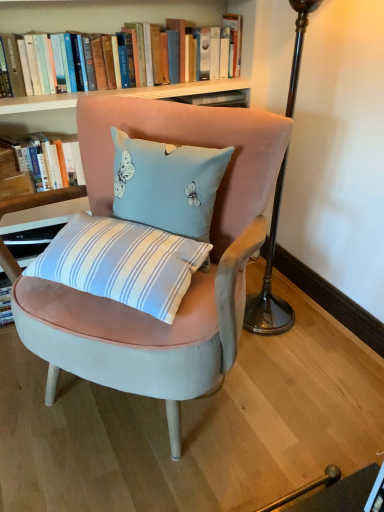
Question: Is velvet pink chair at center thinner than hardcover book at upper left, positioned as the first book in bottom-to-top order?

Choices:
 (A) no
 (B) yes

Answer: (A)

Question: Can you confirm if velvet pink chair at center is wider than hardcover book at upper left, positioned as the first book in bottom-to-top order?

Choices:
 (A) no
 (B) yes

Answer: (B)

Question: From the image's perspective, is velvet pink chair at center beneath hardcover book at upper left, positioned as the first book in bottom-to-top order?

Choices:
 (A) yes
 (B) no

Answer: (A)

Question: Is hardcover book at upper left, positioned as the first book in bottom-to-top order, surrounded by velvet pink chair at center?

Choices:
 (A) no
 (B) yes

Answer: (A)

Question: Is velvet pink chair at center taller than hardcover book at upper left, positioned as the first book in bottom-to-top order?

Choices:
 (A) no
 (B) yes

Answer: (B)

Question: Is light blue velvet cushion at center to the left or to the right of hardcover book at upper left, which is counted as the 2th book, starting from the top, in the image?

Choices:
 (A) left
 (B) right

Answer: (B)

Question: In terms of width, does light blue velvet cushion at center look wider or thinner when compared to hardcover book at upper left, which is counted as the 2th book, starting from the top?

Choices:
 (A) thin
 (B) wide

Answer: (B)

Question: Is light blue velvet cushion at center taller or shorter than hardcover book at upper left, which is counted as the 2th book, starting from the top?

Choices:
 (A) tall
 (B) short

Answer: (A)

Question: Looking at the image, does light blue velvet cushion at center seem bigger or smaller compared to hardcover book at upper left, positioned as the first book in bottom-to-top order?

Choices:
 (A) small
 (B) big

Answer: (B)

Question: From the image's perspective, relative to light blue velvet cushion at center, is hardcover book at upper left, which is counted as the 2th book, starting from the top, above or below?

Choices:
 (A) below
 (B) above

Answer: (B)

Question: Is hardcover book at upper left, positioned as the first book in bottom-to-top order, taller or shorter than light blue velvet cushion at center?

Choices:
 (A) tall
 (B) short

Answer: (B)

Question: Based on their sizes in the image, would you say hardcover book at upper left, positioned as the first book in bottom-to-top order, is bigger or smaller than light blue velvet cushion at center?

Choices:
 (A) big
 (B) small

Answer: (B)

Question: Is hardcover book at upper left, positioned as the first book in bottom-to-top order, inside the boundaries of light blue velvet cushion at center, or outside?

Choices:
 (A) outside
 (B) inside

Answer: (A)

Question: Considering their positions, is hardcover books at upper center, the second book in the bottom-to-top sequence, located in front of or behind velvet pink chair at center?

Choices:
 (A) front
 (B) behind

Answer: (B)

Question: Is hardcover books at upper center, marked as the 1th book in a top-to-bottom arrangement, wider or thinner than velvet pink chair at center?

Choices:
 (A) wide
 (B) thin

Answer: (B)